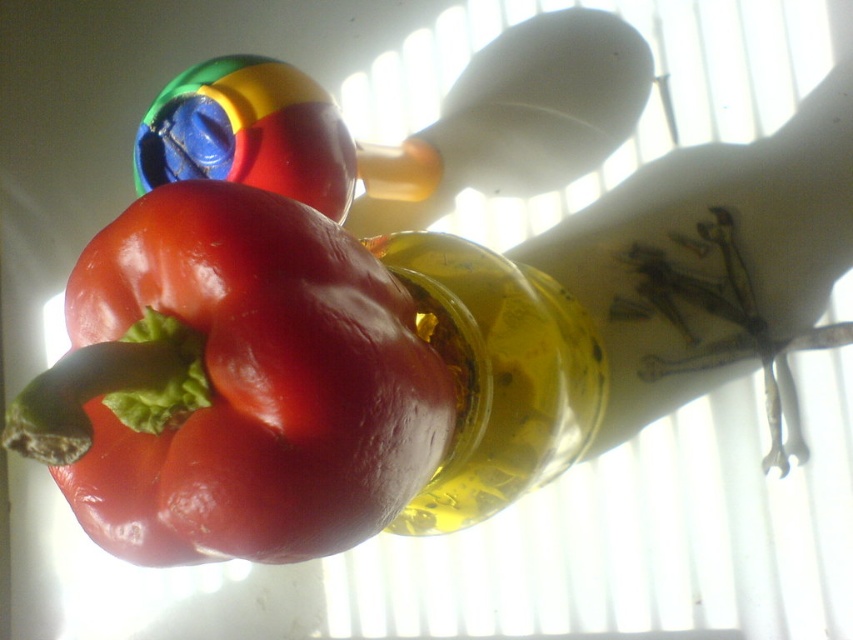
Is point (279, 378) more distant than point (409, 250)?

No.

Does shiny red bell pepper at center have a larger size compared to translucent yellow bottle at center?

Correct, shiny red bell pepper at center is larger in size than translucent yellow bottle at center.

The width and height of the screenshot is (853, 640). In order to click on shiny red bell pepper at center in this screenshot , I will do click(x=234, y=385).

Locate an element on the screen. shiny red bell pepper at center is located at coordinates (234, 385).

Describe the element at coordinates (496, 376) in the screenshot. I see `translucent yellow bottle at center` at that location.

Does translucent yellow bottle at center appear under shiny plastic ball at upper center?

Indeed, translucent yellow bottle at center is positioned under shiny plastic ball at upper center.

The height and width of the screenshot is (640, 853). What do you see at coordinates (496, 376) in the screenshot?
I see `translucent yellow bottle at center` at bounding box center [496, 376].

The width and height of the screenshot is (853, 640). I want to click on translucent yellow bottle at center, so click(x=496, y=376).

Does shiny red bell pepper at center come behind shiny plastic ball at upper center?

No, shiny red bell pepper at center is closer to the viewer.

Is shiny red bell pepper at center thinner than shiny plastic ball at upper center?

No.

Between point (167, 540) and point (195, 86), which one is positioned behind?

The point (195, 86) is behind.

Locate an element on the screen. This screenshot has width=853, height=640. shiny red bell pepper at center is located at coordinates (234, 385).